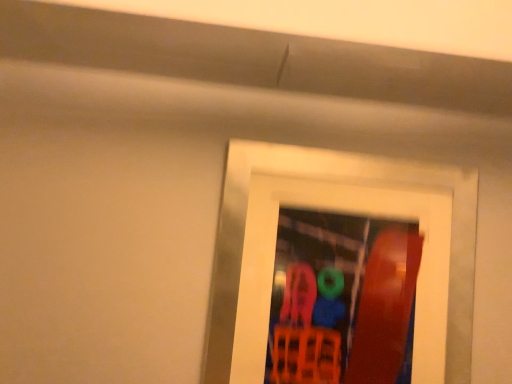
The image size is (512, 384). Identify the location of white matte picture frame at upper center. (353, 212).

What do you see at coordinates (353, 212) in the screenshot? This screenshot has width=512, height=384. I see `white matte picture frame at upper center` at bounding box center [353, 212].

What is the approximate width of white matte picture frame at upper center?

The width of white matte picture frame at upper center is 2.67 inches.

You are a GUI agent. You are given a task and a screenshot of the screen. Output one action in this format:
    pyautogui.click(x=<x>, y=<y>)
    Task: Click on the white matte picture frame at upper center
    This screenshot has height=384, width=512.
    Given the screenshot: What is the action you would take?
    pyautogui.click(x=353, y=212)